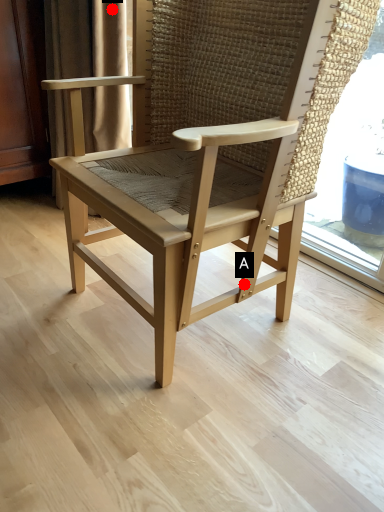
Question: Two points are circled on the image, labeled by A and B beside each circle. Which point is closer to the camera?

Choices:
 (A) A is closer
 (B) B is closer

Answer: (A)